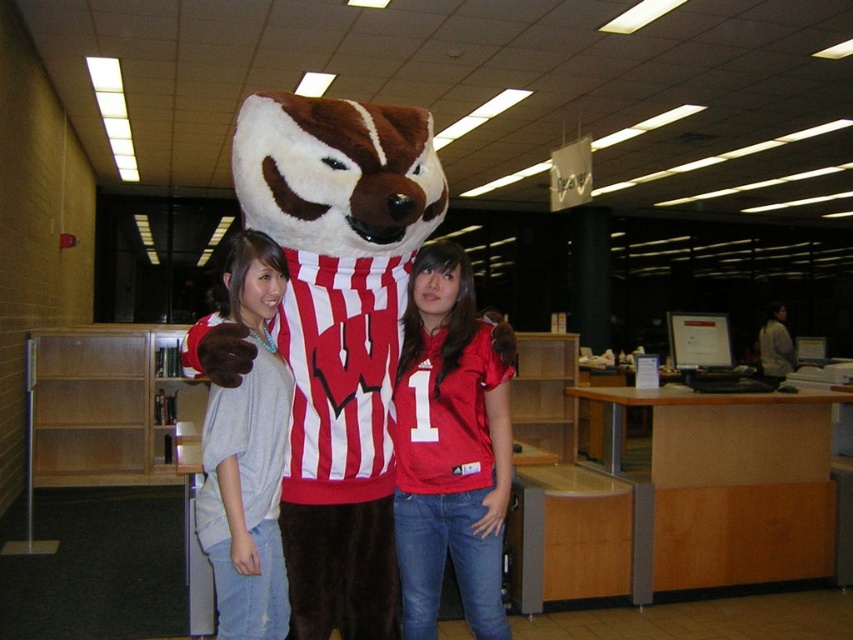
Question: Which of the following is the farthest from the observer?

Choices:
 (A) brown plush mascot at center
 (B) matte red jersey at center

Answer: (B)

Question: Is brown plush mascot at center smaller than light gray cotton shirt at center?

Choices:
 (A) no
 (B) yes

Answer: (A)

Question: Which object is positioned closest to the light gray cotton shirt at center?

Choices:
 (A) brown plush mascot at center
 (B) matte red jersey at center

Answer: (A)

Question: Is brown plush mascot at center below matte red jersey at center?

Choices:
 (A) yes
 (B) no

Answer: (B)

Question: Which point is closer to the camera?

Choices:
 (A) brown plush mascot at center
 (B) matte red jersey at center

Answer: (A)

Question: Does brown plush mascot at center appear over matte red jersey at center?

Choices:
 (A) no
 (B) yes

Answer: (B)